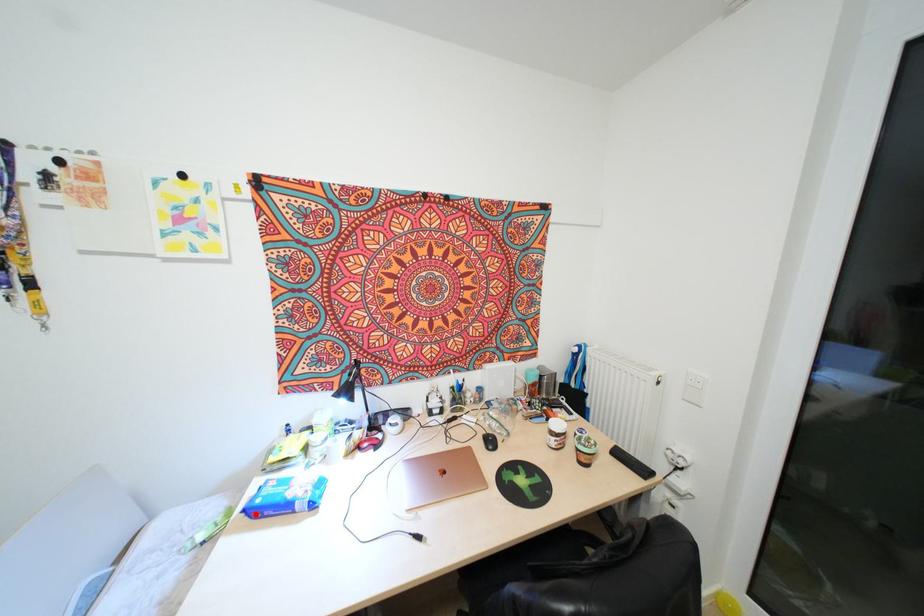
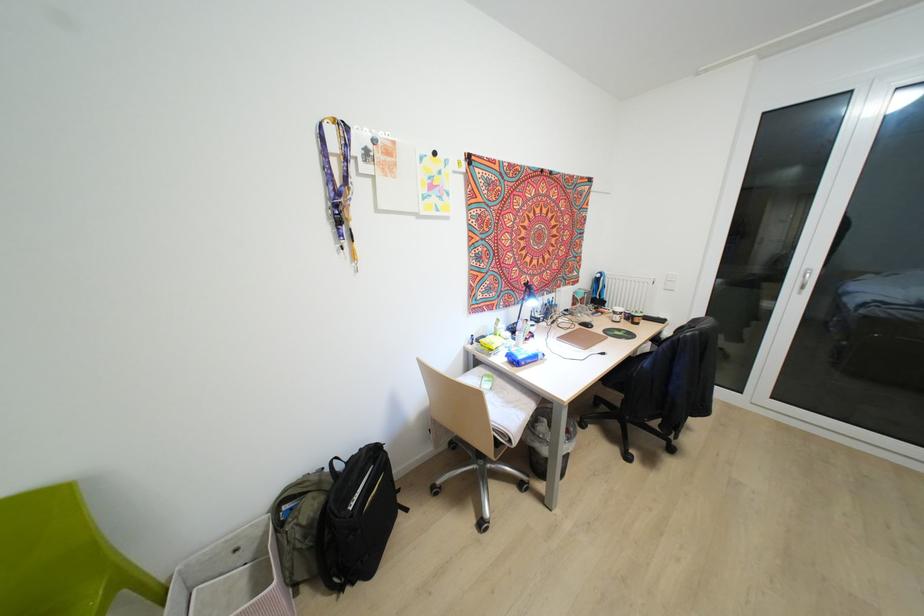
Question: I am providing you with two images of the same scene from different viewpoints. A red point is marked on the first image. At the location where the point appears in image 1, is it still visible in image 2?

Choices:
 (A) Yes
 (B) No

Answer: (A)